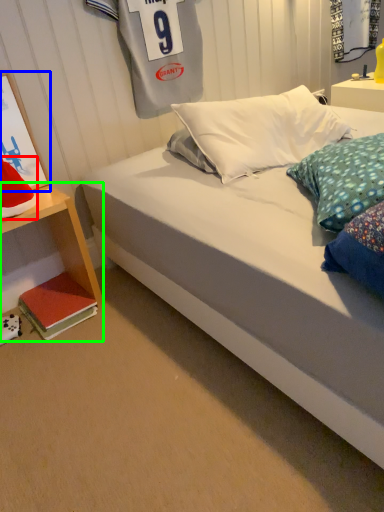
Question: Which object is positioned closest to pillow (highlighted by a red box)? Select from picture frame (highlighted by a blue box) and nightstand (highlighted by a green box).

Choices:
 (A) picture frame
 (B) nightstand

Answer: (A)